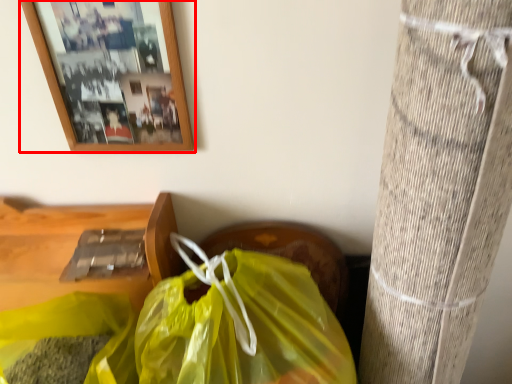
Question: Observing the image, what is the correct spatial positioning of picture frame (annotated by the red box) in reference to plastic bag?

Choices:
 (A) right
 (B) left

Answer: (B)